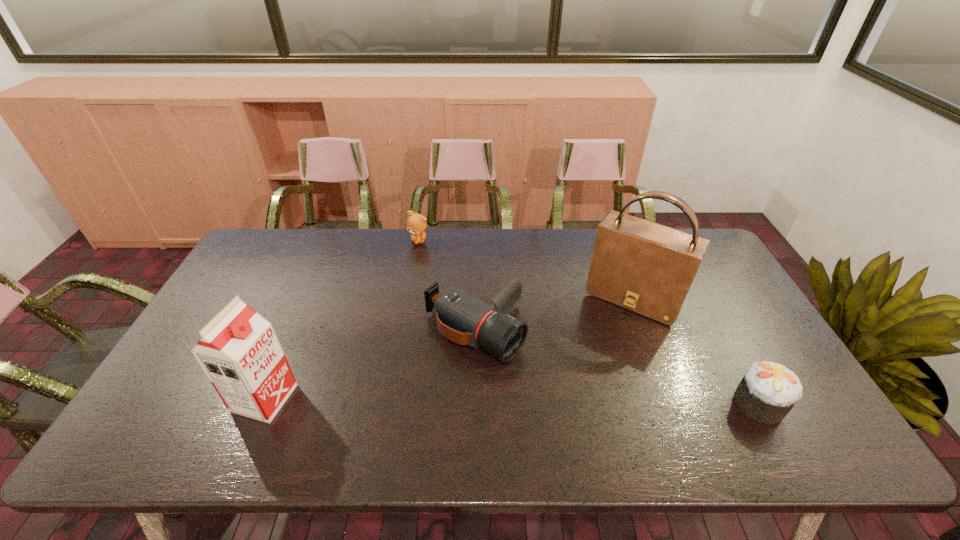
Find the location of a particular element. soya milk is located at coordinates (239, 352).

Image resolution: width=960 pixels, height=540 pixels. In order to click on the leftmost object in this screenshot , I will do `click(239, 352)`.

What are the coordinates of `the rightmost object` in the screenshot? It's located at (768, 391).

The image size is (960, 540). What are the coordinates of `the farthest object` in the screenshot? It's located at (416, 224).

Find the location of a particular element. teddy bear is located at coordinates (416, 224).

Find the location of a particular element. The image size is (960, 540). camcorder is located at coordinates (460, 317).

Identify the location of shoulder bag. This screenshot has width=960, height=540. (648, 268).

The width and height of the screenshot is (960, 540). What are the coordinates of `the fourth object from left to right` in the screenshot? It's located at (x=648, y=268).

Identify the location of free space located 0.090m on the left of the leftmost object. The width and height of the screenshot is (960, 540). (200, 398).

Identify the location of vacant region located 0.050m on the right of the cupcake. The width and height of the screenshot is (960, 540). (804, 404).